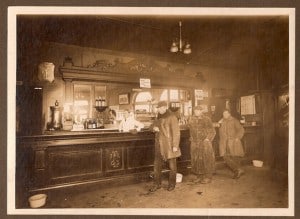
Locate an element on the screen. The height and width of the screenshot is (219, 300). coat is located at coordinates (166, 133), (204, 128), (232, 128).